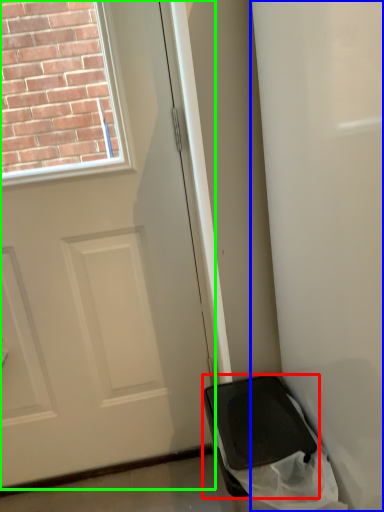
Question: Which object is the closest to the furniture (highlighted by a red box)? Choose among these: screen door (highlighted by a blue box) or door (highlighted by a green box).

Choices:
 (A) screen door
 (B) door

Answer: (A)